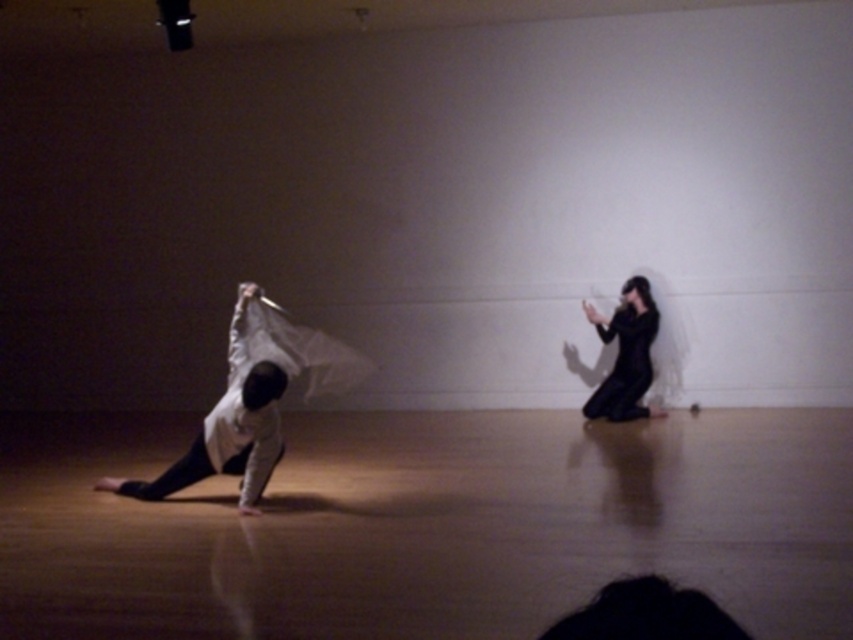
Question: Does white matte fabric at left appear under black matte dress at right?

Choices:
 (A) no
 (B) yes

Answer: (B)

Question: Is white matte fabric at left to the left of black matte dress at right from the viewer's perspective?

Choices:
 (A) yes
 (B) no

Answer: (A)

Question: Which point is farther from the camera taking this photo?

Choices:
 (A) (608, 401)
 (B) (270, 422)

Answer: (A)

Question: Which object appears closest to the camera in this image?

Choices:
 (A) white matte fabric at left
 (B) black matte dress at right

Answer: (A)

Question: Does white matte fabric at left have a larger size compared to black matte dress at right?

Choices:
 (A) no
 (B) yes

Answer: (B)